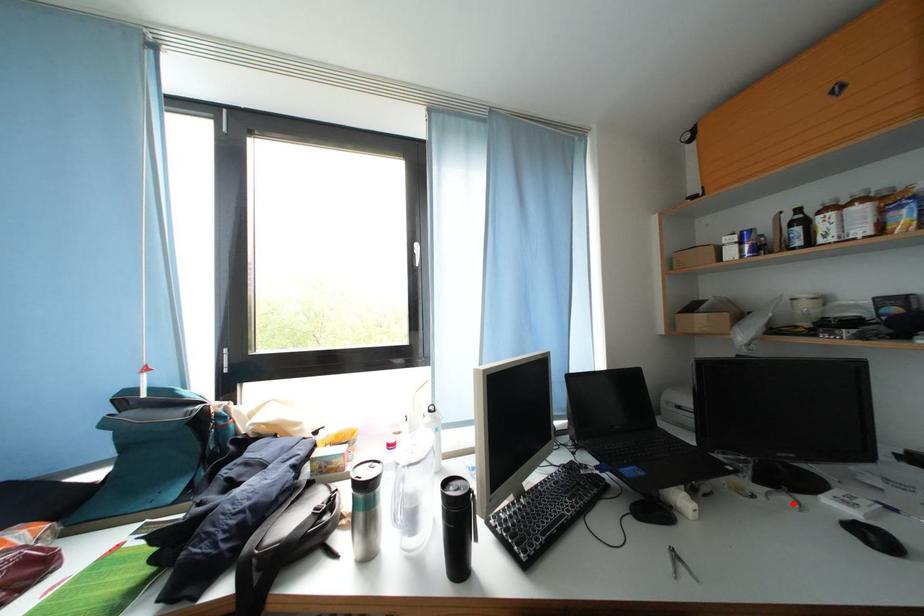
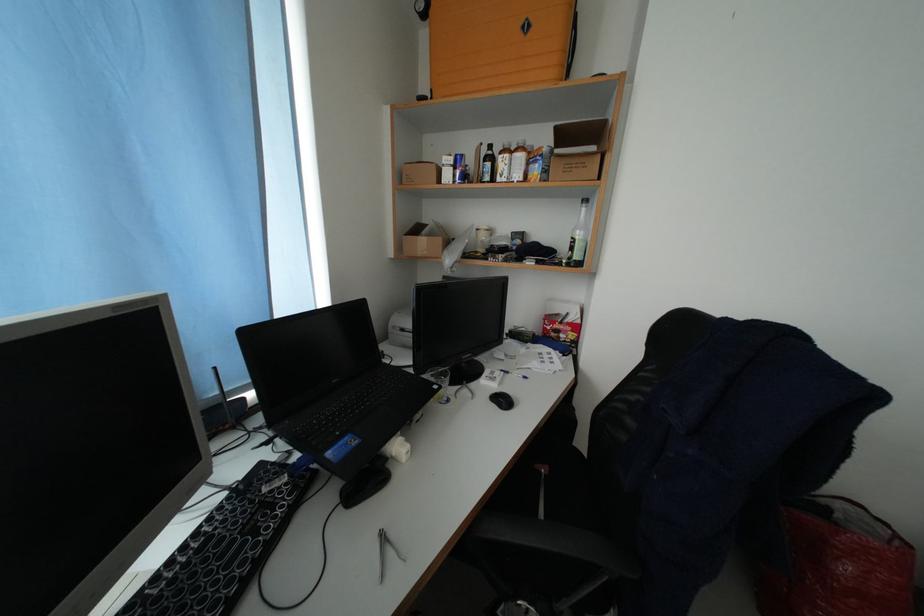
Locate, in the second image, the point that corresponds to the highlighted location in the first image.

(473, 397)